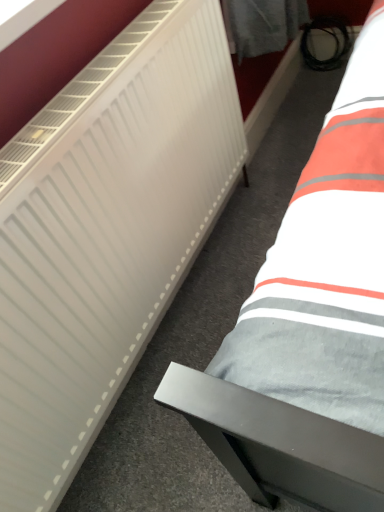
Question: Based on their sizes in the image, would you say white matte radiator at left is bigger or smaller than gray fabric bed at lower right?

Choices:
 (A) big
 (B) small

Answer: (A)

Question: From the image's perspective, is white matte radiator at left above or below gray fabric bed at lower right?

Choices:
 (A) above
 (B) below

Answer: (B)

Question: From a real-world perspective, is white matte radiator at left physically located above or below gray fabric bed at lower right?

Choices:
 (A) above
 (B) below

Answer: (A)

Question: From their relative heights in the image, would you say gray fabric bed at lower right is taller or shorter than white matte radiator at left?

Choices:
 (A) tall
 (B) short

Answer: (B)

Question: Relative to white matte radiator at left, is gray fabric bed at lower right in front or behind?

Choices:
 (A) front
 (B) behind

Answer: (B)

Question: From the image's perspective, is gray fabric bed at lower right positioned above or below white matte radiator at left?

Choices:
 (A) above
 (B) below

Answer: (A)

Question: Based on their sizes in the image, would you say gray fabric bed at lower right is bigger or smaller than white matte radiator at left?

Choices:
 (A) big
 (B) small

Answer: (B)